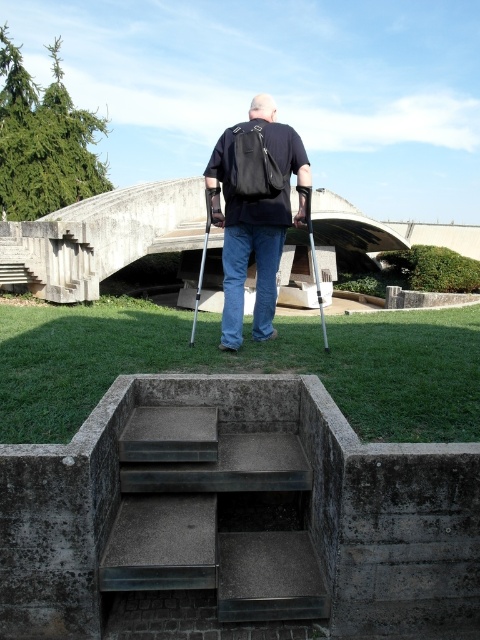
You are a delivery person who needs to place a package on the ground. You have a black matte backpack at center and a metallic silver crutch at center. Which item can you place without needing to adjust its position due to width constraints if the space is narrow?

The black matte backpack at center has a lesser width compared to the metallic silver crutch at center, so it can be placed in a narrow space without needing adjustment.

You are a physical therapist observing the man using his two crutches. Based on the scene, can you determine if the distance between the metallic silver crutch at center and the silver metallic crutch at center is safe for maintaining balance? Please provide your reasoning.

The metallic silver crutch at center and silver metallic crutch at center are 3.31 meters apart from each other. This distance is excessively wide for proper balance, as typical crutch spacing should align closer to shoulder width for stability. The man may be at risk of losing balance due to the excessive separation between the crutches.

From the picture: You are a hiker who needs to carry both the black matte backpack at center and the metallic silver crutch at center. If you have a storage compartment that can only hold items smaller than the crutch, will the backpack fit inside?

The black matte backpack at center is smaller than the metallic silver crutch at center, so it will fit inside the storage compartment designed for items smaller than the crutch.